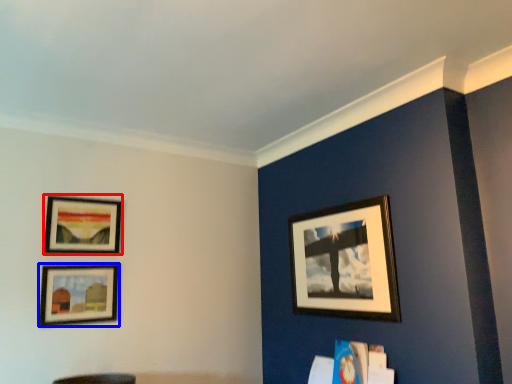
Question: Which point is closer to the camera, picture frame (highlighted by a red box) or picture frame (highlighted by a blue box)?

Choices:
 (A) picture frame
 (B) picture frame

Answer: (B)